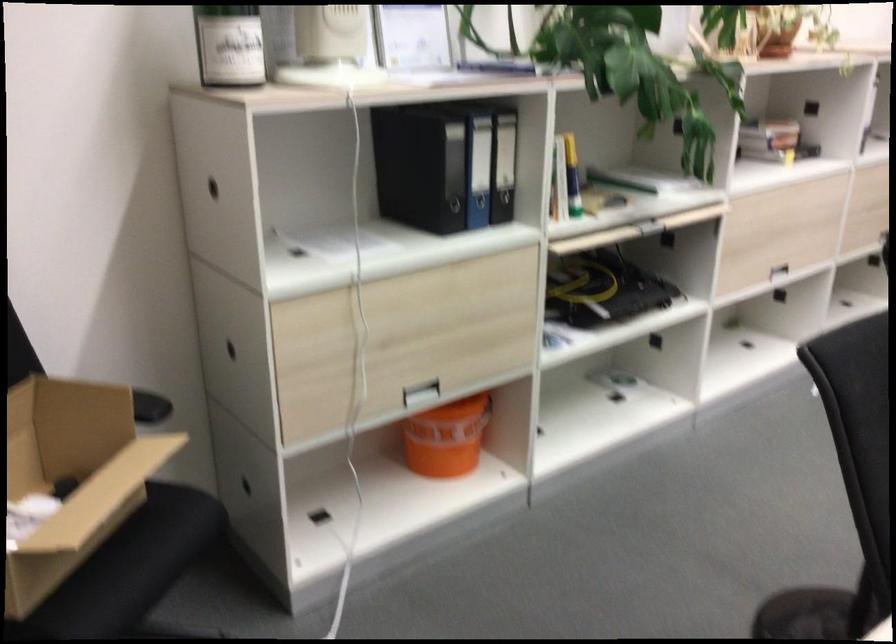
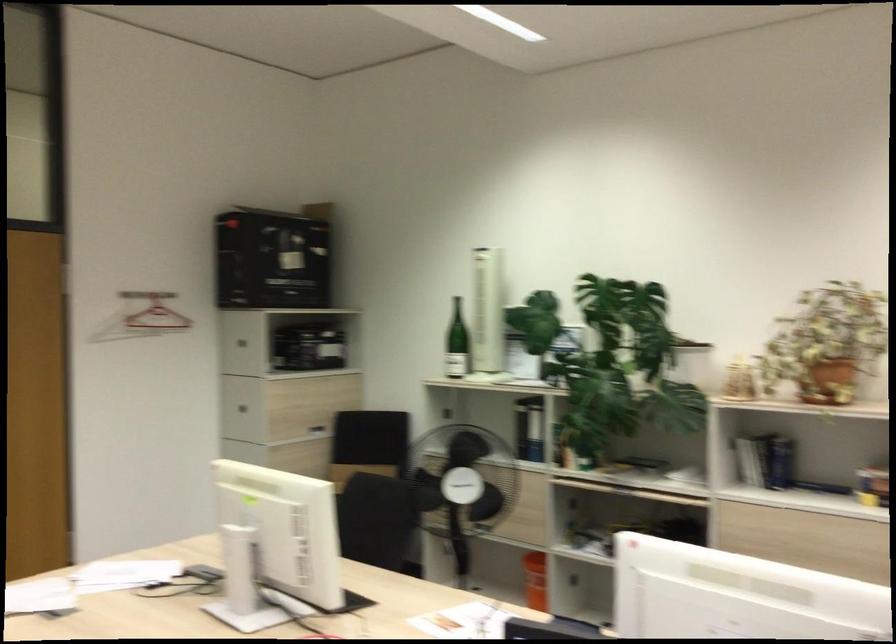
Locate, in the second image, the point that corresponds to [487,444] in the first image.

(535, 580)